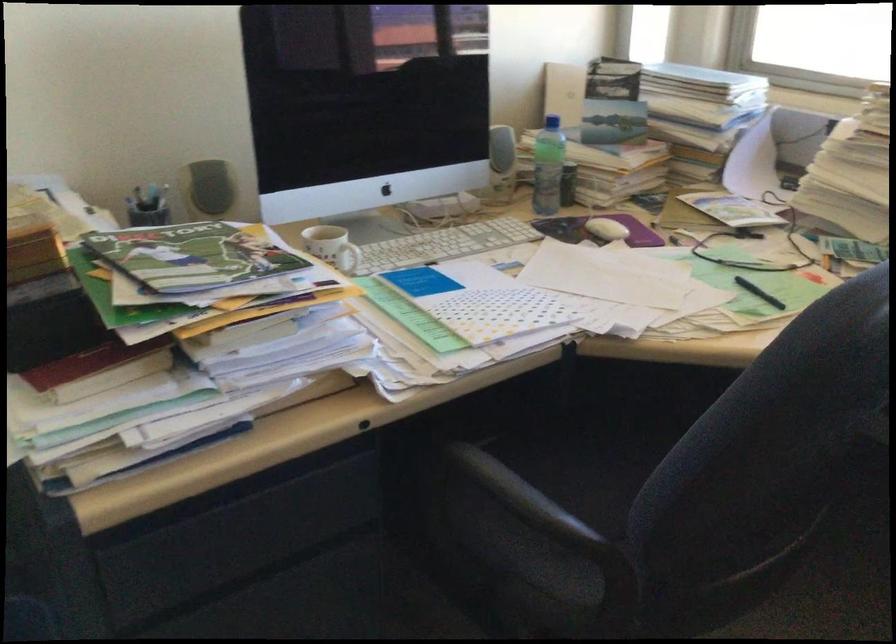
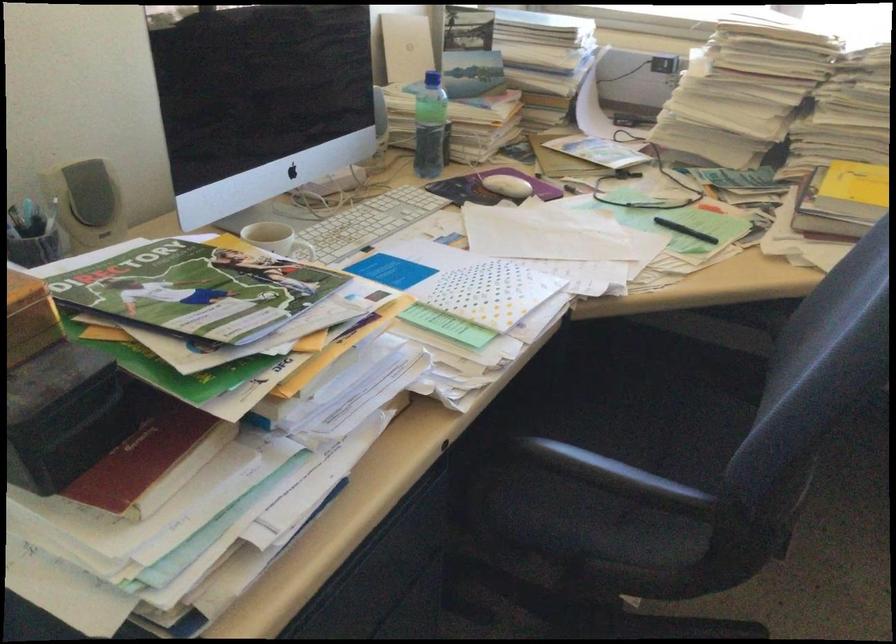
Locate, in the second image, the point that corresponds to (757,290) in the first image.

(684, 230)